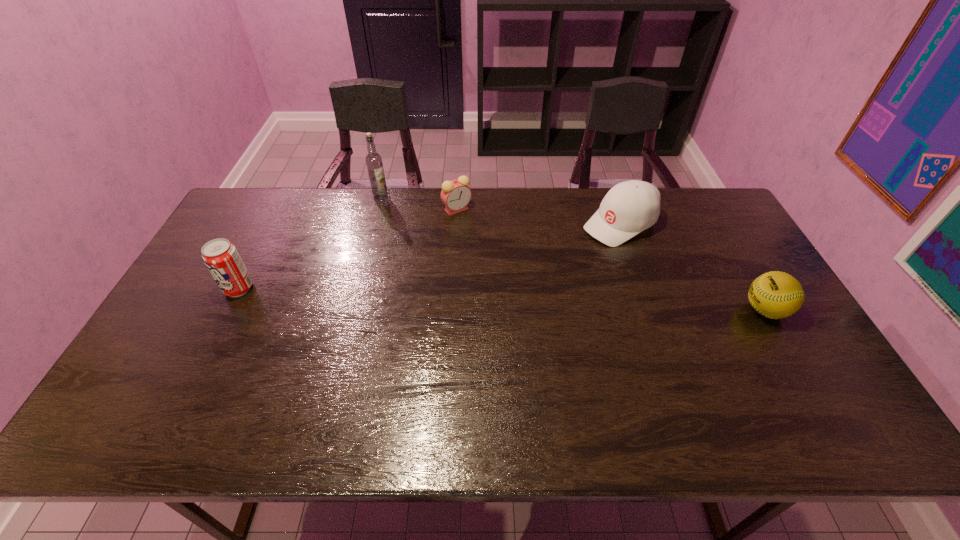
What are the coordinates of `object that ranks as the closest to the second object from right to left` in the screenshot? It's located at (775, 294).

This screenshot has width=960, height=540. Find the location of `vacant space that satisfies the following two spatial constraints: 1. on the front side of the softball; 2. on the logo side of the soda can`. vacant space that satisfies the following two spatial constraints: 1. on the front side of the softball; 2. on the logo side of the soda can is located at coordinates (228, 310).

Locate an element on the screen. free region that satisfies the following two spatial constraints: 1. on the front side of the third object from left to right; 2. on the logo side of the softball is located at coordinates (451, 310).

Identify the location of vacant area that satisfies the following two spatial constraints: 1. on the front side of the second object from left to right; 2. on the right side of the second object from right to left. (373, 224).

Find the location of a particular element. The image size is (960, 540). vacant space that satisfies the following two spatial constraints: 1. on the front side of the third object from right to left; 2. on the left side of the fourth object from left to right is located at coordinates (456, 224).

In order to click on free space that satisfies the following two spatial constraints: 1. on the front side of the tallest object; 2. on the left side of the alarm clock in this screenshot , I will do `click(377, 210)`.

The width and height of the screenshot is (960, 540). In order to click on free location that satisfies the following two spatial constraints: 1. on the front side of the rightmost object; 2. on the logo side of the leftmost object in this screenshot , I will do `click(228, 310)`.